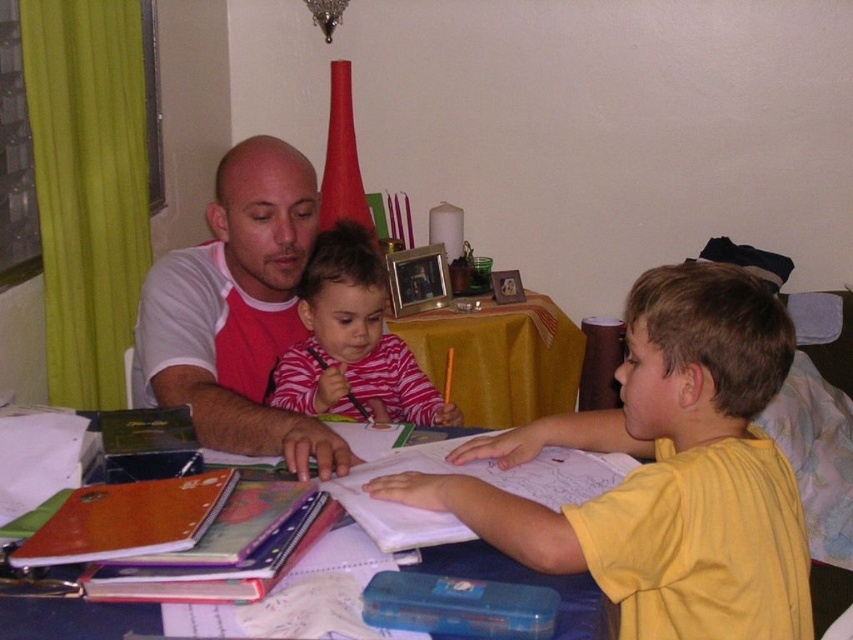
You are looking at the table in the image. There are two points on the table labeled as point 1 and point 2. Point 1 is at coordinate point (689, 600) and point 2 is at coordinate point (352, 230). If you were to place a small toy car at one of these points, which point would make the toy car appear closer to you?

Point 1 at coordinate point (689, 600) is closer to the camera than point 2 at coordinate point (352, 230). Therefore, placing the toy car at point 1 would make it appear closer to you.

You are a delivery robot with a package that needs to be placed on the blue plastic table at center. You are currently holding the package and standing next to the yellow matte shirt at center. Is there enough space between you and the table to place the package down?

The yellow matte shirt at center and blue plastic table at center are 8.43 inches apart, so there is enough space to place the package down between them.